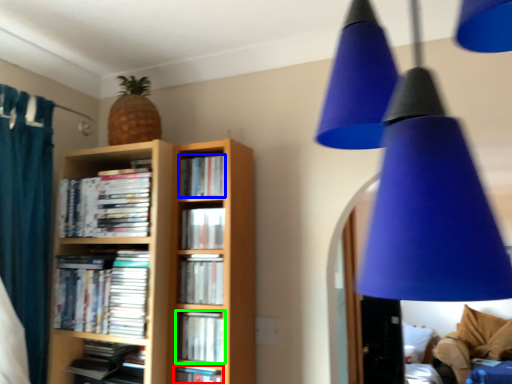
Question: Considering the real-world distances, which object is farthest from book (highlighted by a red box)? book (highlighted by a blue box) or book (highlighted by a green box)?

Choices:
 (A) book
 (B) book

Answer: (A)